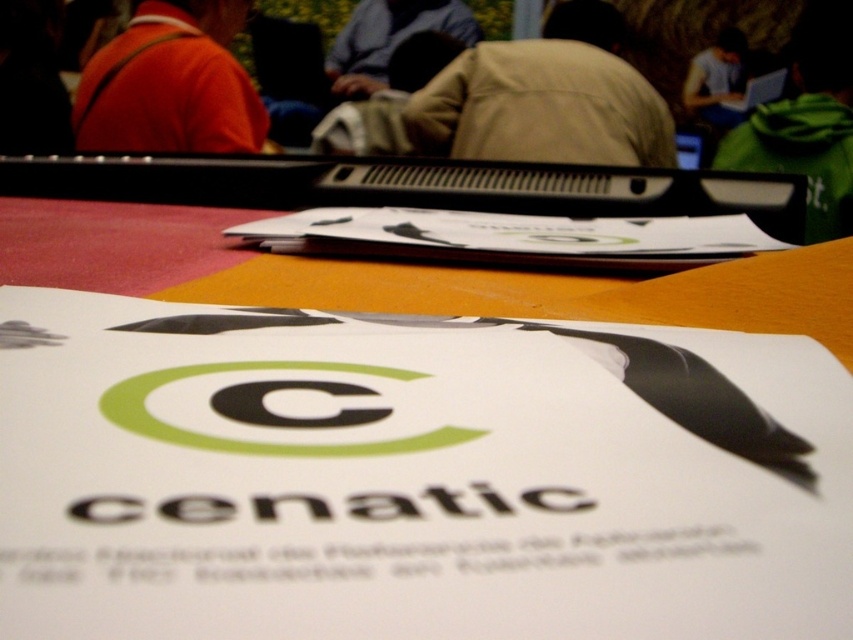
Question: Which point is closer to the camera taking this photo?

Choices:
 (A) (849, 106)
 (B) (387, 58)

Answer: (A)

Question: Does white paper at center come behind black plastic laptop at upper center?

Choices:
 (A) no
 (B) yes

Answer: (A)

Question: Does beige fabric jacket at center appear under green fleece jacket at upper right?

Choices:
 (A) yes
 (B) no

Answer: (B)

Question: Among these objects, which one is nearest to the camera?

Choices:
 (A) blue fabric shirt at upper center
 (B) black plastic laptop at upper center
 (C) white matte laptop at upper right
 (D) white paper at center

Answer: (D)

Question: Does blue fabric shirt at upper center appear on the left side of black plastic laptop at upper center?

Choices:
 (A) no
 (B) yes

Answer: (B)

Question: Which object appears closest to the camera in this image?

Choices:
 (A) matte orange jacket at upper left
 (B) black plastic laptop at upper center
 (C) green fleece jacket at upper right

Answer: (C)